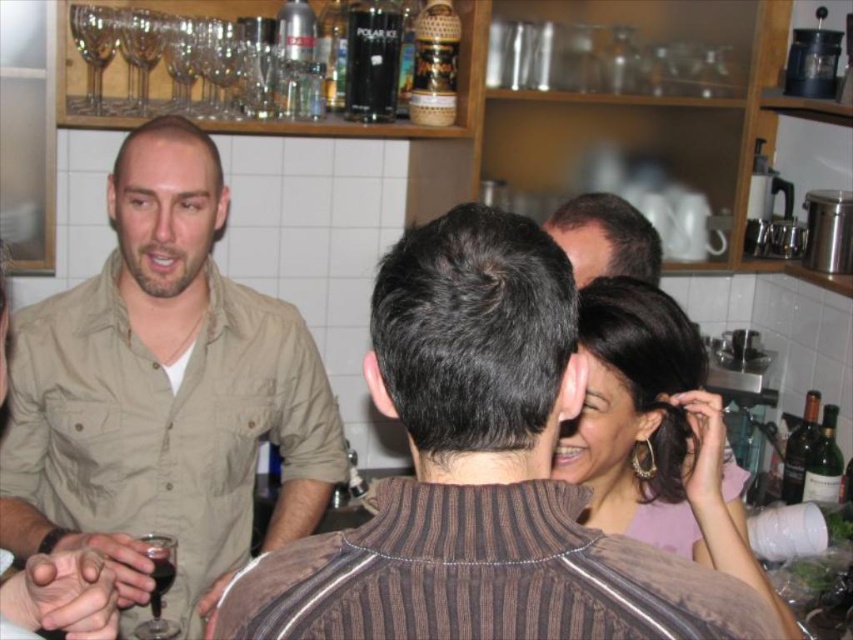
Question: Is gold hoop earrings at upper right in front of green glass bottle at right?

Choices:
 (A) no
 (B) yes

Answer: (B)

Question: Is khaki cotton shirt at left thinner than green glass bottle at right?

Choices:
 (A) yes
 (B) no

Answer: (B)

Question: Which of the following is the farthest from the observer?

Choices:
 (A) (601, 260)
 (B) (838, 477)
 (C) (438, 278)

Answer: (B)

Question: Can you confirm if brown textured shirt at center is bigger than green glass bottle at right?

Choices:
 (A) no
 (B) yes

Answer: (B)

Question: Which is nearer to the brown textured shirt at center?

Choices:
 (A) khaki cotton shirt at left
 (B) dark red liquid at lower left
 (C) transparent glass wine at lower left

Answer: (C)

Question: Among these objects, which one is nearest to the camera?

Choices:
 (A) dark red liquid at lower left
 (B) brown textured shirt at center
 (C) gold hoop earrings at upper right
 (D) dark brown hair at upper center

Answer: (B)